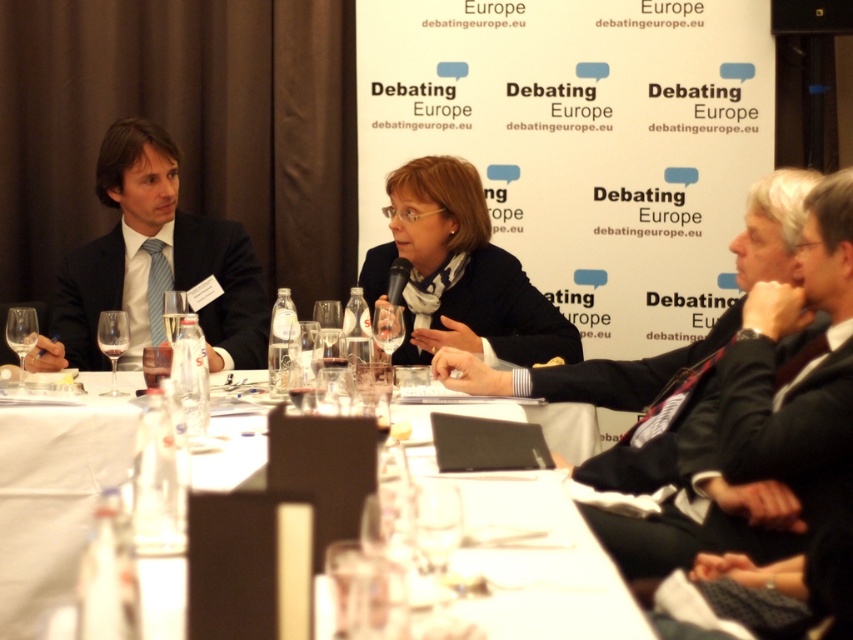
Which is below, white glossy table at center or matte black jacket at center?

white glossy table at center is lower down.

Can you confirm if white glossy table at center is positioned to the left of matte black jacket at center?

Incorrect, white glossy table at center is not on the left side of matte black jacket at center.

Does point (177, 570) come in front of point (451, 256)?

That is True.

Where is `white glossy table at center`? The width and height of the screenshot is (853, 640). white glossy table at center is located at coordinates (53, 499).

Which of these two, dark gray suit at center or matte black jacket at center, stands taller?

dark gray suit at center is taller.

Does dark gray suit at center have a larger size compared to matte black jacket at center?

Correct, dark gray suit at center is larger in size than matte black jacket at center.

In order to click on dark gray suit at center in this screenshot , I will do `click(624, 436)`.

Is white glossy table at center thinner than matte black suit at left?

Indeed, white glossy table at center has a lesser width compared to matte black suit at left.

Describe the element at coordinates (53, 499) in the screenshot. I see `white glossy table at center` at that location.

The width and height of the screenshot is (853, 640). Identify the location of white glossy table at center. (53, 499).

You are a GUI agent. You are given a task and a screenshot of the screen. Output one action in this format:
    pyautogui.click(x=<x>, y=<y>)
    Task: Click on the white glossy table at center
    
    Given the screenshot: What is the action you would take?
    pyautogui.click(x=53, y=499)